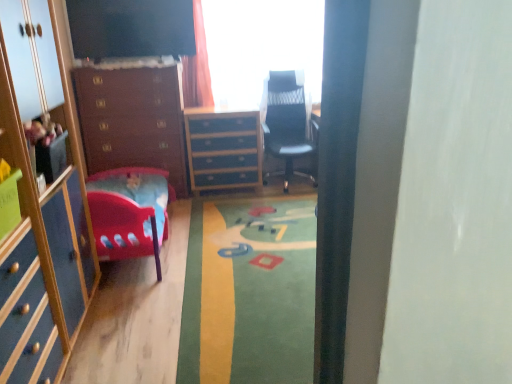
Describe the element at coordinates (132, 119) in the screenshot. I see `wooden chest of drawers at left, marked as the first chest of drawers in a left-to-right arrangement` at that location.

Measure the distance between point (207, 178) and camera.

4.25 meters.

Where is `transparent glass window at upper center`? The height and width of the screenshot is (384, 512). transparent glass window at upper center is located at coordinates point(261,46).

Where is `black mesh office chair at center`? The height and width of the screenshot is (384, 512). black mesh office chair at center is located at coordinates (287, 123).

In terms of height, does wooden chest of drawers at left, marked as the first chest of drawers in a left-to-right arrangement, look taller or shorter compared to blue painted wood chest of drawers at center, acting as the first chest of drawers starting from the right?

Considering their sizes, wooden chest of drawers at left, marked as the first chest of drawers in a left-to-right arrangement, has more height than blue painted wood chest of drawers at center, acting as the first chest of drawers starting from the right.

Considering their positions, is wooden chest of drawers at left, which is the second chest of drawers from right to left, located in front of or behind blue painted wood chest of drawers at center, acting as the first chest of drawers starting from the right?

In the image, wooden chest of drawers at left, which is the second chest of drawers from right to left, appears in front of blue painted wood chest of drawers at center, acting as the first chest of drawers starting from the right.

Considering the points (101, 96) and (196, 138), which point is behind, point (101, 96) or point (196, 138)?

The point (196, 138) is farther from the camera.

From the image's perspective, which one is positioned higher, wooden chest of drawers at left, which is the second chest of drawers from right to left, or black mesh office chair at center?

black mesh office chair at center.

What's the angular difference between wooden chest of drawers at left, marked as the first chest of drawers in a left-to-right arrangement, and black mesh office chair at center's facing directions?

The facing directions of wooden chest of drawers at left, marked as the first chest of drawers in a left-to-right arrangement, and black mesh office chair at center are 0.896 degrees apart.

Is wooden chest of drawers at left, marked as the first chest of drawers in a left-to-right arrangement, bigger than black mesh office chair at center?

Yes.

Is wooden chest of drawers at left, marked as the first chest of drawers in a left-to-right arrangement, to the right of black mesh office chair at center from the viewer's perspective?

No, wooden chest of drawers at left, marked as the first chest of drawers in a left-to-right arrangement, is not to the right of black mesh office chair at center.

From the image's perspective, which is above, transparent glass window at upper center or wooden chest of drawers at left, marked as the first chest of drawers in a left-to-right arrangement?

transparent glass window at upper center, from the image's perspective.

Looking at the image, does transparent glass window at upper center seem bigger or smaller compared to wooden chest of drawers at left, marked as the first chest of drawers in a left-to-right arrangement?

Clearly, transparent glass window at upper center is smaller in size than wooden chest of drawers at left, marked as the first chest of drawers in a left-to-right arrangement.

Measure the distance from transparent glass window at upper center to wooden chest of drawers at left, marked as the first chest of drawers in a left-to-right arrangement.

A distance of 36.98 inches exists between transparent glass window at upper center and wooden chest of drawers at left, marked as the first chest of drawers in a left-to-right arrangement.

From a real-world perspective, between transparent glass window at upper center and wooden chest of drawers at left, marked as the first chest of drawers in a left-to-right arrangement, who is vertically lower?

From a 3D spatial view, wooden chest of drawers at left, marked as the first chest of drawers in a left-to-right arrangement, is below.

Can you confirm if blue painted wood chest of drawers at center, which is counted as the 2th chest of drawers, starting from the left, is shorter than wooden chest of drawers at left, which is the second chest of drawers from right to left?

Yes, blue painted wood chest of drawers at center, which is counted as the 2th chest of drawers, starting from the left, is shorter than wooden chest of drawers at left, which is the second chest of drawers from right to left.

Is blue painted wood chest of drawers at center, which is counted as the 2th chest of drawers, starting from the left, located outside wooden chest of drawers at left, which is the second chest of drawers from right to left?

That's correct, blue painted wood chest of drawers at center, which is counted as the 2th chest of drawers, starting from the left, is outside of wooden chest of drawers at left, which is the second chest of drawers from right to left.

Is blue painted wood chest of drawers at center, acting as the first chest of drawers starting from the right, to the left of wooden chest of drawers at left, which is the second chest of drawers from right to left, from the viewer's perspective?

Incorrect, blue painted wood chest of drawers at center, acting as the first chest of drawers starting from the right, is not on the left side of wooden chest of drawers at left, which is the second chest of drawers from right to left.

From a real-world perspective, is blue painted wood chest of drawers at center, which is counted as the 2th chest of drawers, starting from the left, physically located above or below wooden chest of drawers at left, which is the second chest of drawers from right to left?

blue painted wood chest of drawers at center, which is counted as the 2th chest of drawers, starting from the left, is below wooden chest of drawers at left, which is the second chest of drawers from right to left.

Is blue painted wood chest of drawers at center, acting as the first chest of drawers starting from the right, taller or shorter than transparent glass window at upper center?

Clearly, blue painted wood chest of drawers at center, acting as the first chest of drawers starting from the right, is shorter compared to transparent glass window at upper center.

Is blue painted wood chest of drawers at center, acting as the first chest of drawers starting from the right, not close to transparent glass window at upper center?

No, blue painted wood chest of drawers at center, acting as the first chest of drawers starting from the right, is not far away from transparent glass window at upper center.

From a real-world perspective, is blue painted wood chest of drawers at center, which is counted as the 2th chest of drawers, starting from the left, located beneath transparent glass window at upper center?

Indeed, from a real-world perspective, blue painted wood chest of drawers at center, which is counted as the 2th chest of drawers, starting from the left, is positioned beneath transparent glass window at upper center.

In the image, is blue painted wood chest of drawers at center, which is counted as the 2th chest of drawers, starting from the left, positioned in front of or behind transparent glass window at upper center?

blue painted wood chest of drawers at center, which is counted as the 2th chest of drawers, starting from the left, is positioned farther from the viewer than transparent glass window at upper center.

In the image, is black mesh office chair at center positioned in front of or behind matte blue cabinet at left?

Visually, black mesh office chair at center is located behind matte blue cabinet at left.

Is black mesh office chair at center far away from matte blue cabinet at left?

Yes, black mesh office chair at center and matte blue cabinet at left are located far from each other.

Can you confirm if black mesh office chair at center is bigger than matte blue cabinet at left?

Yes.

Is blue painted wood chest of drawers at center, acting as the first chest of drawers starting from the right, not inside black mesh office chair at center?

Yes, blue painted wood chest of drawers at center, acting as the first chest of drawers starting from the right, is located beyond the bounds of black mesh office chair at center.

Is blue painted wood chest of drawers at center, which is counted as the 2th chest of drawers, starting from the left, not near black mesh office chair at center?

No, blue painted wood chest of drawers at center, which is counted as the 2th chest of drawers, starting from the left, is in close proximity to black mesh office chair at center.

Locate an element on the screen. the chest of drawers that is the 1st one when counting leftward from the black mesh office chair at center is located at coordinates coord(223,149).

Which of these two, blue painted wood chest of drawers at center, which is counted as the 2th chest of drawers, starting from the left, or black mesh office chair at center, stands shorter?

blue painted wood chest of drawers at center, which is counted as the 2th chest of drawers, starting from the left, is shorter.

Where is `chest of drawers to the left of blue painted wood chest of drawers at center, which is counted as the 2th chest of drawers, starting from the left`? This screenshot has width=512, height=384. chest of drawers to the left of blue painted wood chest of drawers at center, which is counted as the 2th chest of drawers, starting from the left is located at coordinates (132, 119).

In the image, there is a wooden chest of drawers at left, marked as the first chest of drawers in a left-to-right arrangement. Identify the location of chair below it (from a real-world perspective). This screenshot has width=512, height=384. (287, 123).

Which object lies further to the anchor point blue painted wood chest of drawers at center, acting as the first chest of drawers starting from the right, transparent glass window at upper center or matte blue cabinet at left?

matte blue cabinet at left.

Estimate the real-world distances between objects in this image. Which object is closer to wooden chest of drawers at left, marked as the first chest of drawers in a left-to-right arrangement, transparent glass window at upper center or blue painted wood chest of drawers at center, acting as the first chest of drawers starting from the right?

Among the two, blue painted wood chest of drawers at center, acting as the first chest of drawers starting from the right, is located nearer to wooden chest of drawers at left, marked as the first chest of drawers in a left-to-right arrangement.

Considering their positions, is wooden chest of drawers at left, marked as the first chest of drawers in a left-to-right arrangement, positioned further to black mesh office chair at center than matte blue cabinet at left?

matte blue cabinet at left is further to black mesh office chair at center.

From the image, which object appears to be farther from wooden chest of drawers at left, which is the second chest of drawers from right to left, blue painted wood chest of drawers at center, acting as the first chest of drawers starting from the right, or black mesh office chair at center?

The object further to wooden chest of drawers at left, which is the second chest of drawers from right to left, is black mesh office chair at center.

Which object lies further to the anchor point matte blue cabinet at left, blue painted wood chest of drawers at center, acting as the first chest of drawers starting from the right, or black mesh office chair at center?

black mesh office chair at center is positioned further to the anchor matte blue cabinet at left.

Which object lies nearer to the anchor point transparent glass window at upper center, black mesh office chair at center or wooden chest of drawers at left, marked as the first chest of drawers in a left-to-right arrangement?

Among the two, black mesh office chair at center is located nearer to transparent glass window at upper center.

Considering their positions, is matte blue cabinet at left positioned further to transparent glass window at upper center than wooden chest of drawers at left, which is the second chest of drawers from right to left?

matte blue cabinet at left is further to transparent glass window at upper center.

Considering their positions, is wooden chest of drawers at left, marked as the first chest of drawers in a left-to-right arrangement, positioned further to matte blue cabinet at left than transparent glass window at upper center?

transparent glass window at upper center lies further to matte blue cabinet at left than the other object.

The height and width of the screenshot is (384, 512). I want to click on window between matte blue cabinet at left and blue painted wood chest of drawers at center, which is counted as the 2th chest of drawers, starting from the left, in the front-back direction, so click(x=261, y=46).

Find the location of a particular element. This screenshot has width=512, height=384. chair between matte blue cabinet at left and transparent glass window at upper center from front to back is located at coordinates (287, 123).

Where is `chair that lies between transparent glass window at upper center and blue painted wood chest of drawers at center, which is counted as the 2th chest of drawers, starting from the left, from top to bottom`? chair that lies between transparent glass window at upper center and blue painted wood chest of drawers at center, which is counted as the 2th chest of drawers, starting from the left, from top to bottom is located at coordinates (287, 123).

Where is `chair between matte blue cabinet at left and blue painted wood chest of drawers at center, acting as the first chest of drawers starting from the right, from front to back`? The image size is (512, 384). chair between matte blue cabinet at left and blue painted wood chest of drawers at center, acting as the first chest of drawers starting from the right, from front to back is located at coordinates (287, 123).